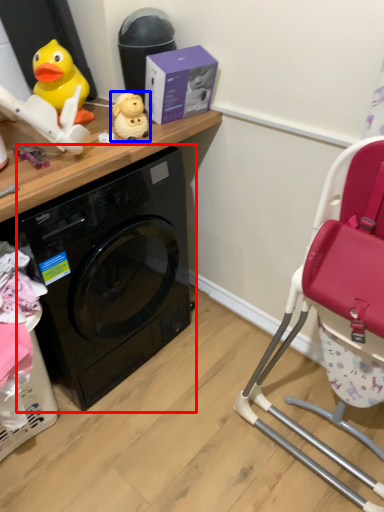
Question: Which object is further to the camera taking this photo, washing machine (highlighted by a red box) or toy (highlighted by a blue box)?

Choices:
 (A) washing machine
 (B) toy

Answer: (B)